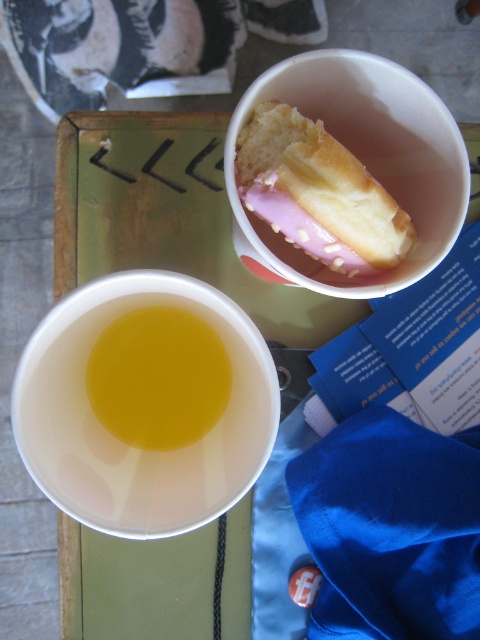
Question: Which of the following is the farthest from the observer?

Choices:
 (A) translucent yellow liquid at upper left
 (B) pink glazed donut at upper center

Answer: (A)

Question: Where is pink glazed donut at upper center located in relation to translucent yellow liquid at upper left in the image?

Choices:
 (A) right
 (B) left

Answer: (A)

Question: In this image, where is pink glazed donut at upper center located relative to translucent yellow liquid at upper left?

Choices:
 (A) left
 (B) right

Answer: (B)

Question: Is pink glazed donut at upper center to the right of translucent yellow liquid at upper left from the viewer's perspective?

Choices:
 (A) yes
 (B) no

Answer: (A)

Question: Which object appears farthest from the camera in this image?

Choices:
 (A) translucent yellow liquid at upper left
 (B) pink glazed donut at upper center

Answer: (A)